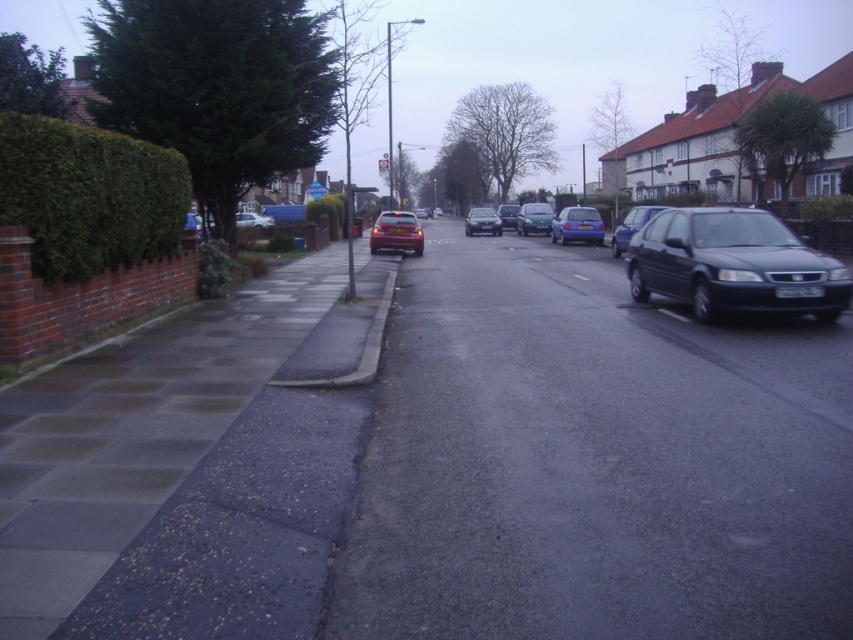
Which is above, gray concrete curb at lower center or metallic silver sedan at center?

metallic silver sedan at center is higher up.

Is gray concrete curb at lower center positioned before metallic silver sedan at center?

Yes, it is.

Which is behind, point (311, 380) or point (524, 211)?

The point (524, 211) is behind.

This screenshot has height=640, width=853. Find the location of `gray concrete curb at lower center`. gray concrete curb at lower center is located at coordinates (361, 352).

Who is lower down, dark asphalt pavement at center or shiny silver sedan at center?

dark asphalt pavement at center is lower down.

Where is `dark asphalt pavement at center`? dark asphalt pavement at center is located at coordinates (595, 461).

You are a GUI agent. You are given a task and a screenshot of the screen. Output one action in this format:
    pyautogui.click(x=<x>, y=<y>)
    Task: Click on the dark asphalt pavement at center
    This screenshot has height=640, width=853.
    Given the screenshot: What is the action you would take?
    pyautogui.click(x=595, y=461)

Between gray concrete curb at lower center and matte silver car at center, which one is positioned lower?

gray concrete curb at lower center is below.

Is point (389, 298) farther from viewer compared to point (271, 218)?

No, it is in front of (271, 218).

Where is `gray concrete curb at lower center`? gray concrete curb at lower center is located at coordinates (361, 352).